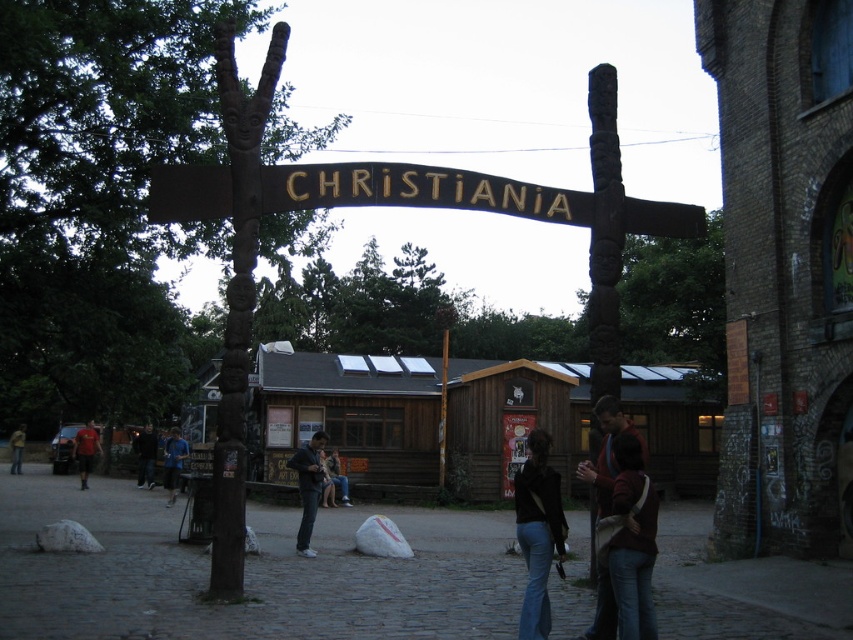
Is wooden sign at center above brown leather jacket at center?

Yes, wooden sign at center is above brown leather jacket at center.

Which is below, wooden sign at center or brown leather jacket at center?

brown leather jacket at center is below.

Between point (648, 230) and point (631, 460), which one is positioned behind?

The point (648, 230) is behind.

Identify the location of wooden sign at center. (416, 189).

Between brown leather jacket at center and yellow fabric jacket at lower left, which one has less height?

brown leather jacket at center

Can you confirm if brown leather jacket at center is shorter than yellow fabric jacket at lower left?

Correct, brown leather jacket at center is not as tall as yellow fabric jacket at lower left.

Who is more forward, (616, 561) or (18, 429)?

Point (616, 561)

Identify the location of brown leather jacket at center. The image size is (853, 640). (631, 541).

Does dark brown leather jacket at center have a larger size compared to dark blue jeans at lower left?

Correct, dark brown leather jacket at center is larger in size than dark blue jeans at lower left.

At what (x,y) coordinates should I click in order to perform the action: click on dark brown leather jacket at center. Please return your answer as a coordinate pair (x, y). This screenshot has width=853, height=640. Looking at the image, I should click on [x=601, y=432].

Is point (593, 426) positioned in front of point (141, 460)?

That is True.

Find the location of a particular element. This screenshot has width=853, height=640. dark brown leather jacket at center is located at coordinates (601, 432).